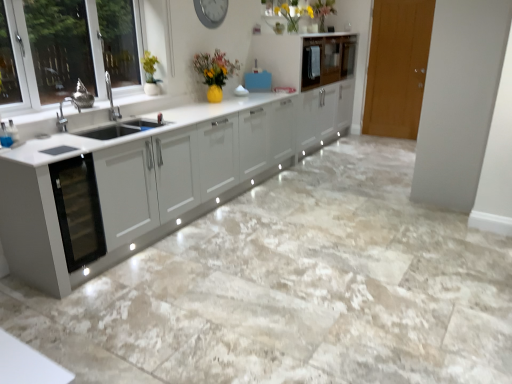
Locate an element on the screen. vacant location below wooden door at right (from a real-world perspective) is located at coordinates (395, 139).